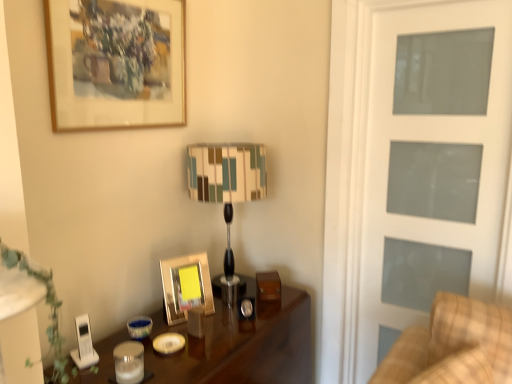
Image resolution: width=512 pixels, height=384 pixels. Describe the element at coordinates (186, 286) in the screenshot. I see `gold metallic picture frame at center, which ranks as the 2th picture frame in top-to-bottom order` at that location.

The height and width of the screenshot is (384, 512). What are the coordinates of `shiny dark wood table at center` in the screenshot? It's located at (240, 346).

Based on the photo, in order to face striped fabric lampshade at center, should I rotate leftwards or rightwards?

Turn left approximately 3.262 degrees to face it.

Where is `gold metallic picture frame at center, which ranks as the first picture frame in bottom-to-top order`? gold metallic picture frame at center, which ranks as the first picture frame in bottom-to-top order is located at coordinates pos(186,286).

In the scene shown: Which object is thinner, gold metallic picture frame at center, which ranks as the 2th picture frame in top-to-bottom order, or plaid fabric couch at right?

Thinner between the two is gold metallic picture frame at center, which ranks as the 2th picture frame in top-to-bottom order.

Which object is more forward, gold metallic picture frame at center, which ranks as the 2th picture frame in top-to-bottom order, or plaid fabric couch at right?

plaid fabric couch at right is more forward.

Is gold metallic picture frame at center, which ranks as the 2th picture frame in top-to-bottom order, turned away from plaid fabric couch at right?

No.

Are gold metallic picture frame at center, which ranks as the first picture frame in bottom-to-top order, and plaid fabric couch at right located far from each other?

No.

Is plaid fabric couch at right placed right next to striped fabric lampshade at center?

There is a gap between plaid fabric couch at right and striped fabric lampshade at center.

Looking at their sizes, would you say plaid fabric couch at right is wider or thinner than striped fabric lampshade at center?

plaid fabric couch at right is thinner than striped fabric lampshade at center.

Considering the relative positions of plaid fabric couch at right and striped fabric lampshade at center in the image provided, is plaid fabric couch at right to the right of striped fabric lampshade at center from the viewer's perspective?

Indeed, plaid fabric couch at right is positioned on the right side of striped fabric lampshade at center.

Between point (473, 311) and point (192, 179), which one is positioned behind?

The point (192, 179) is farther from the camera.

From the image's perspective, which one is positioned lower, striped fabric lampshade at center or gold metallic picture frame at center, which ranks as the 2th picture frame in top-to-bottom order?

gold metallic picture frame at center, which ranks as the 2th picture frame in top-to-bottom order, appears lower in the image.

Does striped fabric lampshade at center turn towards gold metallic picture frame at center, which ranks as the 2th picture frame in top-to-bottom order?

No, striped fabric lampshade at center is not oriented towards gold metallic picture frame at center, which ranks as the 2th picture frame in top-to-bottom order.

Considering the sizes of objects striped fabric lampshade at center and gold metallic picture frame at center, which ranks as the 2th picture frame in top-to-bottom order, in the image provided, who is wider, striped fabric lampshade at center or gold metallic picture frame at center, which ranks as the 2th picture frame in top-to-bottom order,?

striped fabric lampshade at center is wider.

Can you confirm if striped fabric lampshade at center is bigger than white frosted glass screen door at right?

Yes, striped fabric lampshade at center is bigger than white frosted glass screen door at right.

From the picture: Would you say striped fabric lampshade at center contains white frosted glass screen door at right?

That's incorrect, white frosted glass screen door at right is not inside striped fabric lampshade at center.

Considering the sizes of striped fabric lampshade at center and white frosted glass screen door at right in the image, is striped fabric lampshade at center wider or thinner than white frosted glass screen door at right?

In the image, striped fabric lampshade at center appears to be wider than white frosted glass screen door at right.

Does point (202, 186) lie in front of point (441, 231)?

No.

From the image's perspective, is green leafy plant at lower left located beneath shiny dark wood table at center?

Actually, green leafy plant at lower left appears above shiny dark wood table at center in the image.

Considering the relative positions of green leafy plant at lower left and shiny dark wood table at center in the image provided, is green leafy plant at lower left to the right of shiny dark wood table at center from the viewer's perspective?

No, green leafy plant at lower left is not to the right of shiny dark wood table at center.

In the scene shown: Does green leafy plant at lower left have a larger size compared to shiny dark wood table at center?

Actually, green leafy plant at lower left might be smaller than shiny dark wood table at center.

Is green leafy plant at lower left aimed at shiny dark wood table at center?

No, green leafy plant at lower left is not facing towards shiny dark wood table at center.

Is green leafy plant at lower left situated inside wooden framed artwork at upper left, which is the second picture frame from bottom to top, or outside?

green leafy plant at lower left cannot be found inside wooden framed artwork at upper left, which is the second picture frame from bottom to top.

Does green leafy plant at lower left touch wooden framed artwork at upper left, the first picture frame viewed from the top?

green leafy plant at lower left and wooden framed artwork at upper left, the first picture frame viewed from the top, are not in contact.

Does green leafy plant at lower left have a larger size compared to wooden framed artwork at upper left, the first picture frame viewed from the top?

Correct, green leafy plant at lower left is larger in size than wooden framed artwork at upper left, the first picture frame viewed from the top.

Between point (9, 251) and point (180, 28), which one is positioned behind?

Positioned behind is point (180, 28).

Considering their positions, is gold metallic picture frame at center, which ranks as the first picture frame in bottom-to-top order, located in front of or behind white frosted glass screen door at right?

Clearly, gold metallic picture frame at center, which ranks as the first picture frame in bottom-to-top order, is behind white frosted glass screen door at right.

Is gold metallic picture frame at center, which ranks as the first picture frame in bottom-to-top order, facing towards white frosted glass screen door at right?

No, gold metallic picture frame at center, which ranks as the first picture frame in bottom-to-top order, is not aimed at white frosted glass screen door at right.

Can you confirm if gold metallic picture frame at center, which ranks as the first picture frame in bottom-to-top order, is bigger than white frosted glass screen door at right?

No, gold metallic picture frame at center, which ranks as the first picture frame in bottom-to-top order, is not bigger than white frosted glass screen door at right.

Visually, is gold metallic picture frame at center, which ranks as the 2th picture frame in top-to-bottom order, positioned to the left or to the right of white frosted glass screen door at right?

From the image, it's evident that gold metallic picture frame at center, which ranks as the 2th picture frame in top-to-bottom order, is to the left of white frosted glass screen door at right.

Locate an element on the screen. This screenshot has width=512, height=384. furniture in front of the gold metallic picture frame at center, which ranks as the 2th picture frame in top-to-bottom order is located at coordinates (453, 346).

This screenshot has width=512, height=384. I want to click on furniture below the striped fabric lampshade at center (from a real-world perspective), so click(453, 346).

From the image, which object appears to be nearer to wooden framed artwork at upper left, the first picture frame viewed from the top, striped fabric lampshade at center or green leafy plant at lower left?

The object closer to wooden framed artwork at upper left, the first picture frame viewed from the top, is striped fabric lampshade at center.

Estimate the real-world distances between objects in this image. Which object is further from green leafy plant at lower left, plaid fabric couch at right or shiny dark wood table at center?

plaid fabric couch at right is further to green leafy plant at lower left.

Estimate the real-world distances between objects in this image. Which object is further from striped fabric lampshade at center, white frosted glass screen door at right or shiny dark wood table at center?

Among the two, white frosted glass screen door at right is located further to striped fabric lampshade at center.

Based on their spatial positions, is striped fabric lampshade at center or green leafy plant at lower left further from white frosted glass screen door at right?

The object further to white frosted glass screen door at right is green leafy plant at lower left.

Looking at the image, which one is located closer to green leafy plant at lower left, gold metallic picture frame at center, which ranks as the first picture frame in bottom-to-top order, or striped fabric lampshade at center?

gold metallic picture frame at center, which ranks as the first picture frame in bottom-to-top order, is closer to green leafy plant at lower left.

Estimate the real-world distances between objects in this image. Which object is further from striped fabric lampshade at center, plaid fabric couch at right or shiny dark wood table at center?

The object further to striped fabric lampshade at center is plaid fabric couch at right.

From the image, which object appears to be nearer to white frosted glass screen door at right, plaid fabric couch at right or striped fabric lampshade at center?

plaid fabric couch at right is closer to white frosted glass screen door at right.

Which object lies nearer to the anchor point plaid fabric couch at right, gold metallic picture frame at center, which ranks as the first picture frame in bottom-to-top order, or wooden framed artwork at upper left, the first picture frame viewed from the top?

The object closer to plaid fabric couch at right is gold metallic picture frame at center, which ranks as the first picture frame in bottom-to-top order.

Locate an element on the screen. The width and height of the screenshot is (512, 384). table positioned between green leafy plant at lower left and gold metallic picture frame at center, which ranks as the first picture frame in bottom-to-top order, from near to far is located at coordinates (240, 346).

At what (x,y) coordinates should I click in order to perform the action: click on table situated between green leafy plant at lower left and plaid fabric couch at right from left to right. Please return your answer as a coordinate pair (x, y). Looking at the image, I should click on (240, 346).

Where is `picture frame situated between green leafy plant at lower left and white frosted glass screen door at right from left to right`? picture frame situated between green leafy plant at lower left and white frosted glass screen door at right from left to right is located at coordinates (186, 286).

The height and width of the screenshot is (384, 512). Identify the location of table located between gold metallic picture frame at center, which ranks as the first picture frame in bottom-to-top order, and plaid fabric couch at right in the left-right direction. (240, 346).